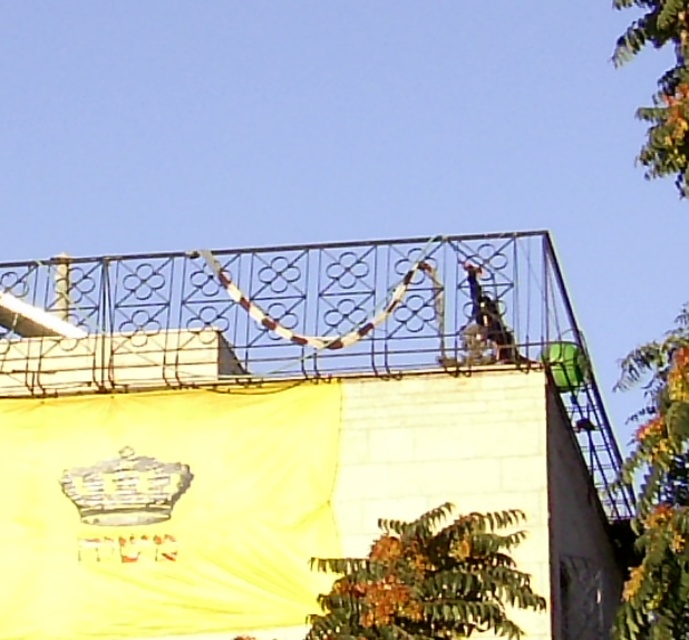
Consider the image. Can you confirm if metallic railing at upper center is shorter than metallic helmet at upper right?

In fact, metallic railing at upper center may be taller than metallic helmet at upper right.

Does metallic railing at upper center have a greater height compared to metallic helmet at upper right?

Correct, metallic railing at upper center is much taller as metallic helmet at upper right.

Is point (45, 310) in front of point (495, 305)?

No, it is not.

Locate an element on the screen. This screenshot has width=689, height=640. metallic railing at upper center is located at coordinates (302, 321).